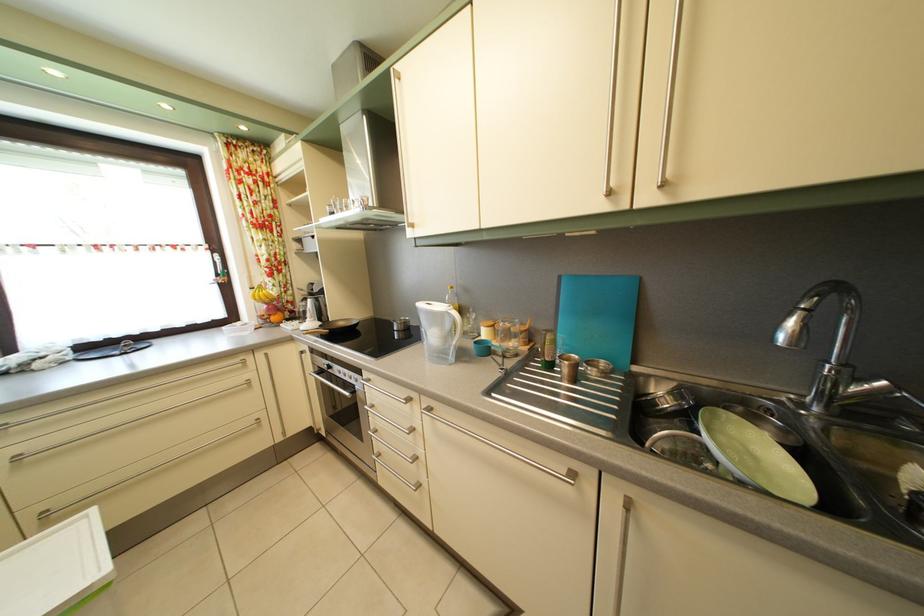
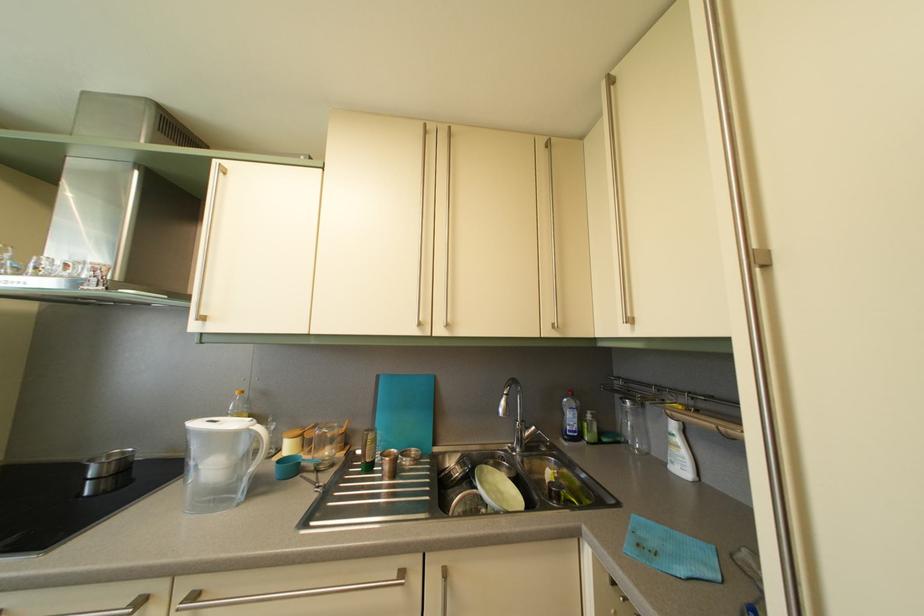
Locate, in the second image, the point that corresponds to (408,328) in the first image.

(118, 463)